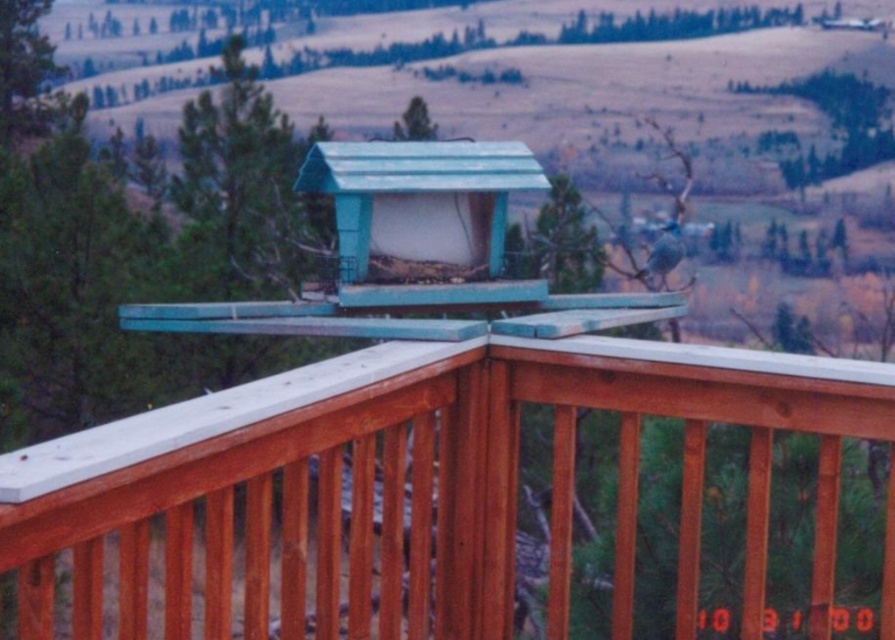
You are a bird looking for a place to land. You see the wooden porch at center and the teal plastic bird feeder at center. Which one can you land on without being too small for your size?

The wooden porch at center has a larger size compared to the teal plastic bird feeder at center, so you can land on the wooden porch at center since it is bigger and provides enough space for your size.

You are standing on the wooden deck railing and want to place a new decorative pot at point [423,483]. According to the scene description, what object is already present at that location?

The wooden porch at center is already present at point [423,483].

You are standing on the wooden porch at center and want to reach the teal plastic bird feeder at center. Which direction should you move to get closer to the bird feeder?

Since the wooden porch at center is closer to the viewer than the teal plastic bird feeder at center, you should move forward towards the bird feeder to get closer.